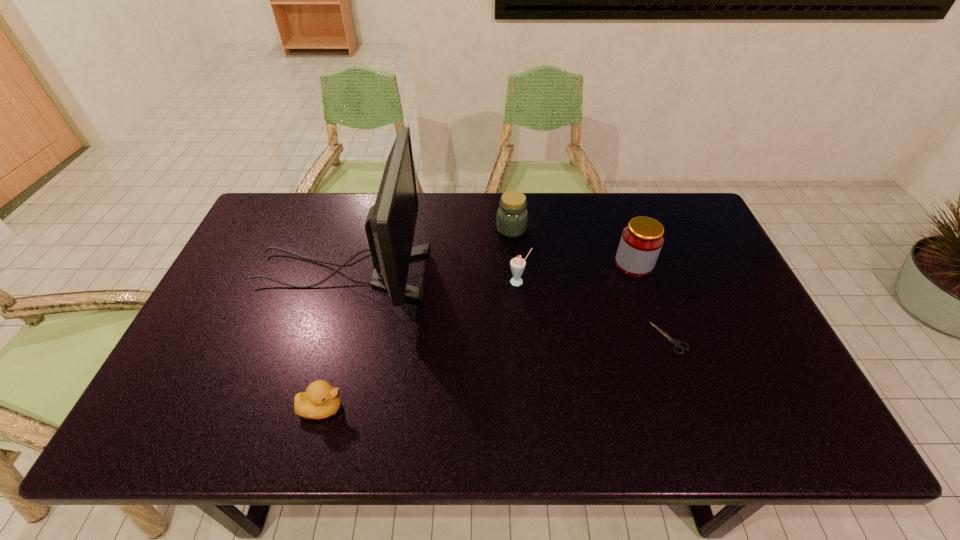
In order to click on vacant space located on the left of the left jar in this screenshot , I will do `click(379, 229)`.

What are the coordinates of `vacant space situated 0.300m on the straw side of the milkshake` in the screenshot? It's located at click(527, 380).

Where is `free spot located 0.390m facing forward on the duckling`? The width and height of the screenshot is (960, 540). free spot located 0.390m facing forward on the duckling is located at coordinates (518, 408).

Where is `vacant area situated on the left of the shears`? The image size is (960, 540). vacant area situated on the left of the shears is located at coordinates (503, 338).

Locate an element on the screen. computer monitor situated at the far edge is located at coordinates (390, 225).

Where is `jar that is at the far edge`? jar that is at the far edge is located at coordinates (512, 216).

At what (x,y) coordinates should I click in order to perform the action: click on object positioned at the near edge. Please return your answer as a coordinate pair (x, y). This screenshot has width=960, height=540. Looking at the image, I should click on (320, 400).

Identify the location of object that is positioned at the left edge. The image size is (960, 540). (390, 225).

Locate an element on the screen. This screenshot has height=540, width=960. object that is at the far left corner is located at coordinates (390, 225).

At what (x,y) coordinates should I click in order to perform the action: click on free space at the far edge of the desktop. Please return your answer as a coordinate pair (x, y). This screenshot has height=540, width=960. Looking at the image, I should click on (552, 200).